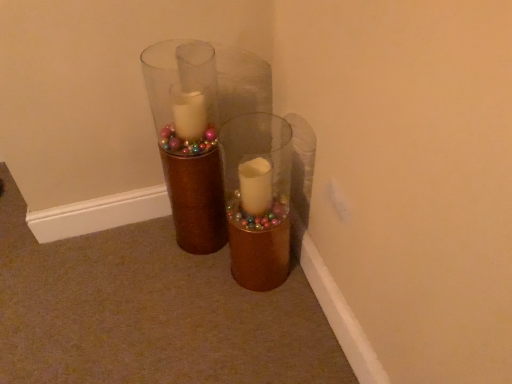
Question: Do you think gold glitter vase at center, which is the 2th vase in right-to-left order, is within brown textured vase at center, the first vase when ordered from right to left, or outside of it?

Choices:
 (A) outside
 (B) inside

Answer: (A)

Question: Considering their positions, is gold glitter vase at center, acting as the 1th vase starting from the left, located in front of or behind brown textured vase at center, which is counted as the 2th vase, starting from the left?

Choices:
 (A) front
 (B) behind

Answer: (B)

Question: Is gold glitter vase at center, acting as the 1th vase starting from the left, taller or shorter than brown textured vase at center, which is counted as the 2th vase, starting from the left?

Choices:
 (A) tall
 (B) short

Answer: (A)

Question: Would you say brown textured vase at center, which is counted as the 2th vase, starting from the left, is inside or outside gold glitter vase at center, which is the 2th vase in right-to-left order?

Choices:
 (A) outside
 (B) inside

Answer: (A)

Question: Does point (259, 220) appear closer or farther from the camera than point (194, 114)?

Choices:
 (A) farther
 (B) closer

Answer: (B)

Question: From a real-world perspective, is brown textured vase at center, which is counted as the 2th vase, starting from the left, above or below gold glitter vase at center, acting as the 1th vase starting from the left?

Choices:
 (A) above
 (B) below

Answer: (B)

Question: Is brown textured vase at center, the first vase when ordered from right to left, in front of or behind gold glitter vase at center, acting as the 1th vase starting from the left, in the image?

Choices:
 (A) behind
 (B) front

Answer: (B)